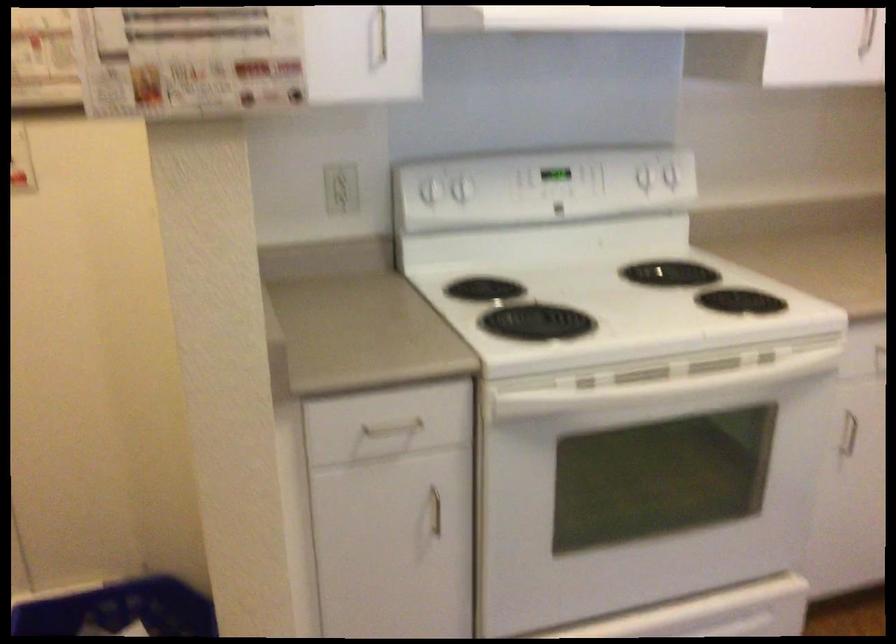
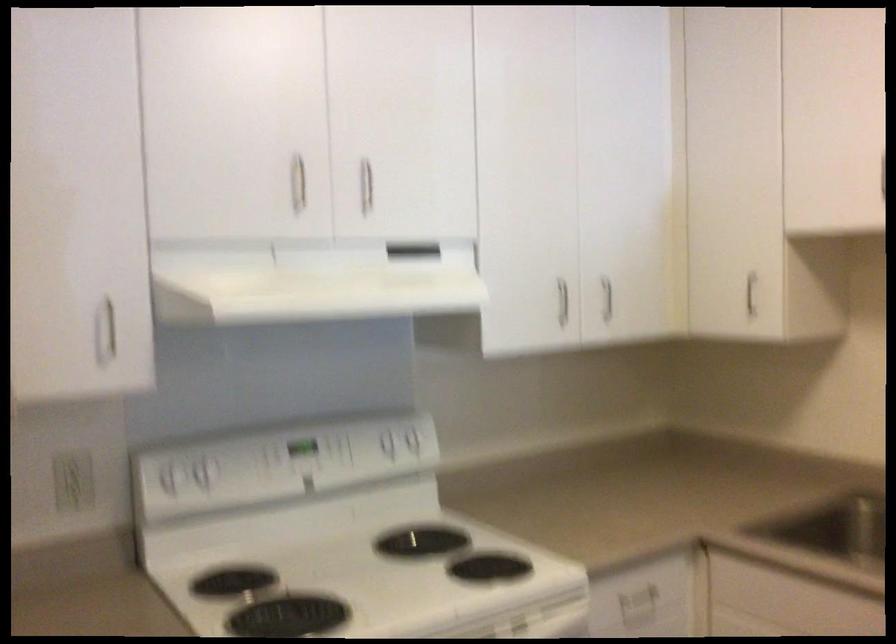
Find the pixel in the second image that matches the point at 346,184 in the first image.

(73, 480)